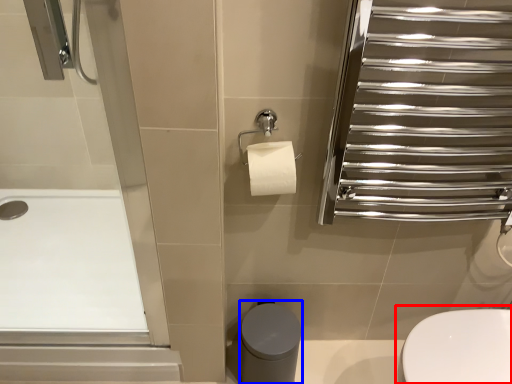
Question: Which object is closer to the camera taking this photo, toilet (highlighted by a red box) or bidet (highlighted by a blue box)?

Choices:
 (A) toilet
 (B) bidet

Answer: (A)